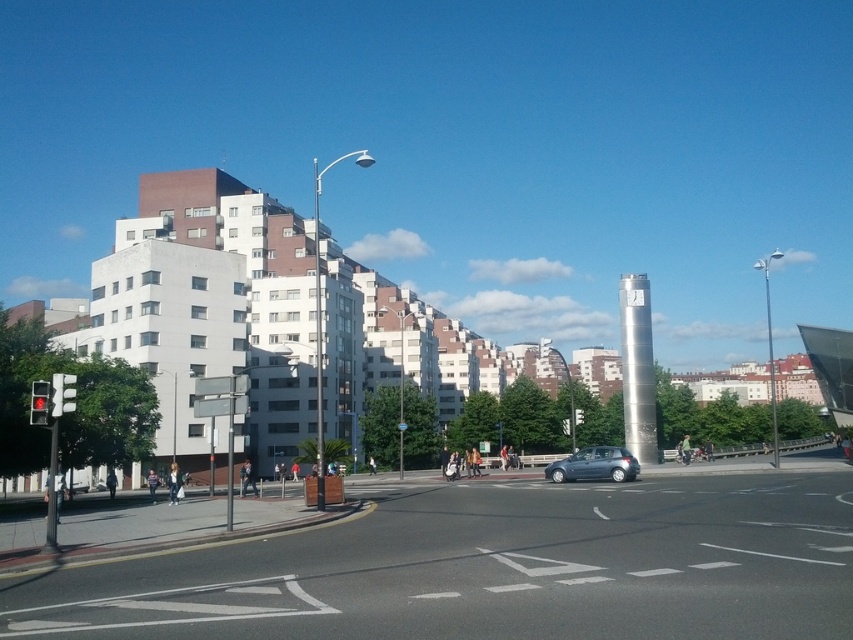
You are a driver approaching the intersection and see the black asphalt road at lower center and the matte black traffic light at left. Which object appears taller in the image?

The black asphalt road at lower center appears taller than the matte black traffic light at left in the image.

You are a delivery drone flying over the urban scene. You need to land on the black asphalt road at lower center. The red glass traffic light at left is in your path. Can you safely navigate around it to reach the road?

The black asphalt road at lower center is located below the red glass traffic light at left, so the drone can safely navigate around the traffic light by descending below it to land on the road.